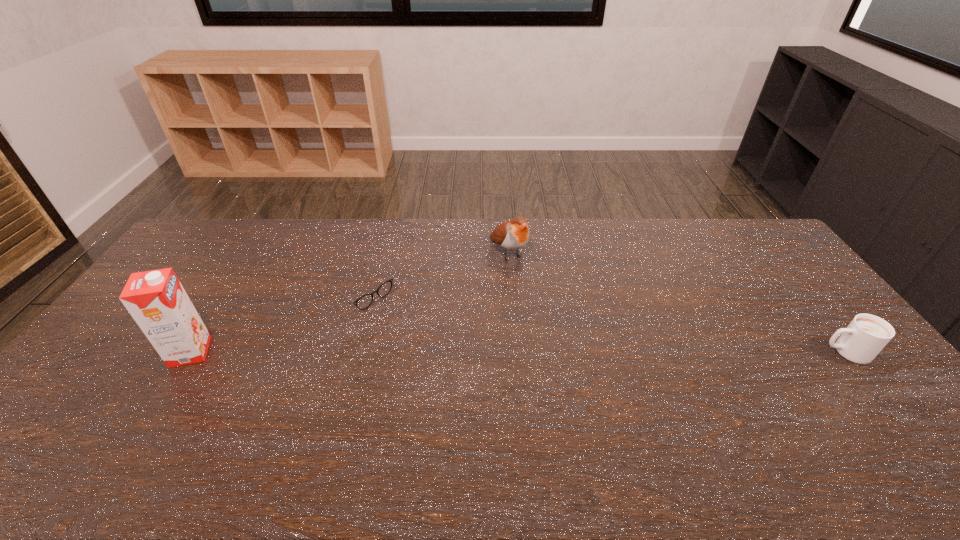
You are a GUI agent. You are given a task and a screenshot of the screen. Output one action in this format:
    pyautogui.click(x=<x>, y=<y>)
    Task: Click on the tallest object
    
    Given the screenshot: What is the action you would take?
    pyautogui.click(x=156, y=300)

Find the location of `the leftmost object`. the leftmost object is located at coordinates (156, 300).

Find the location of a particular element. This screenshot has width=960, height=540. cappuccino is located at coordinates (863, 339).

In order to click on the second shortest object in this screenshot , I will do `click(863, 339)`.

This screenshot has height=540, width=960. Identify the location of the shortest object. (365, 301).

The height and width of the screenshot is (540, 960). What are the coordinates of `the second object from left to right` in the screenshot? It's located at (365, 301).

This screenshot has width=960, height=540. Find the location of `the third shortest object`. the third shortest object is located at coordinates (512, 235).

I want to click on the third object from left to right, so click(x=512, y=235).

The width and height of the screenshot is (960, 540). I want to click on vacant space situated 0.050m on the back of the tallest object, so click(x=208, y=324).

This screenshot has height=540, width=960. What are the coordinates of `vacant space positioned 0.350m on the side with the handle of the rightmost object` in the screenshot? It's located at (698, 352).